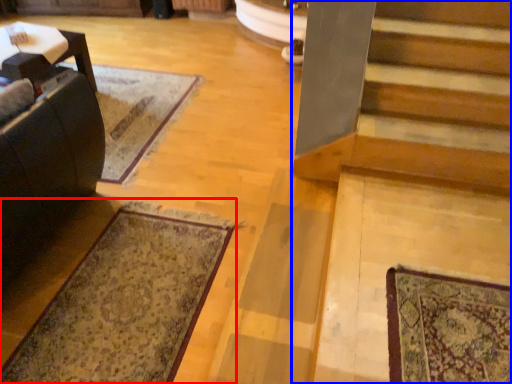
Question: Which object is further to the camera taking this photo, mat (highlighted by a red box) or stairs (highlighted by a blue box)?

Choices:
 (A) mat
 (B) stairs

Answer: (A)